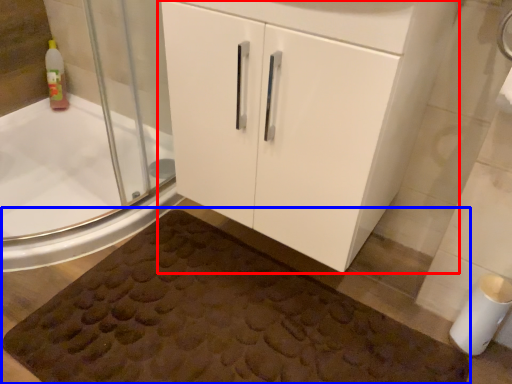
Question: Among these objects, which one is farthest to the camera, bathroom cabinet (highlighted by a red box) or bath mat (highlighted by a blue box)?

Choices:
 (A) bathroom cabinet
 (B) bath mat

Answer: (B)